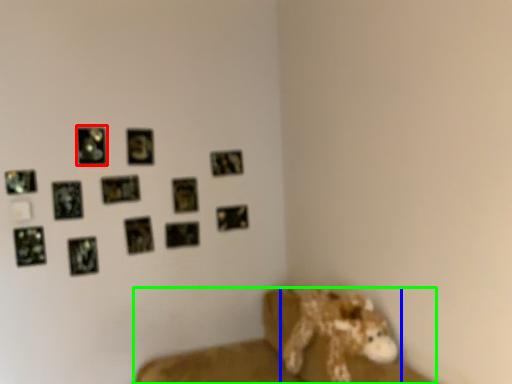
Question: Which is farther away from picture frame (highlighted by a red box)? animal (highlighted by a blue box) or furniture (highlighted by a green box)?

Choices:
 (A) animal
 (B) furniture

Answer: (A)